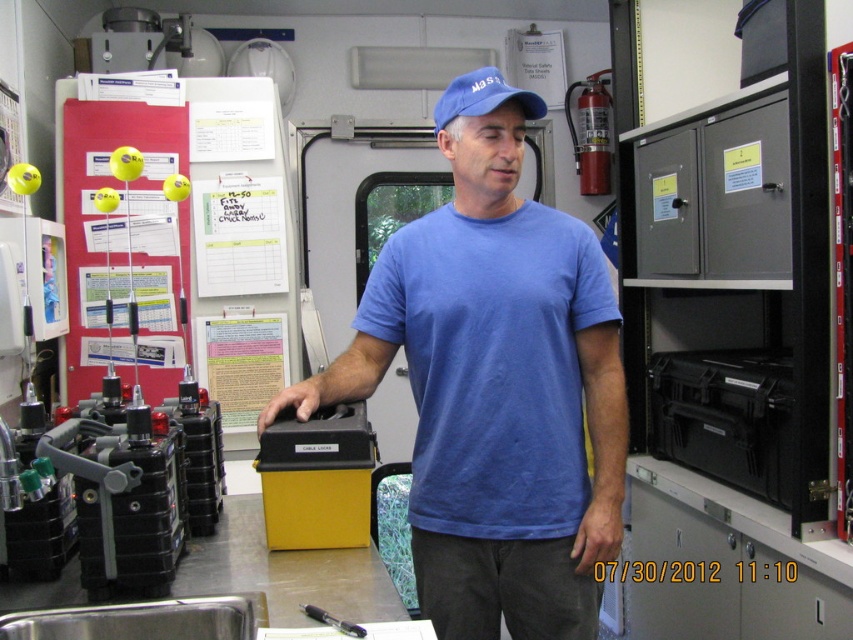
Question: Which point is farther from the camera taking this photo?

Choices:
 (A) (473, 570)
 (B) (447, 92)
 (C) (579, 269)

Answer: (C)

Question: Is matte blue t-shirt at center thinner than blue fabric cap at center?

Choices:
 (A) no
 (B) yes

Answer: (A)

Question: Which of these objects is positioned closest to the blue cotton t-shirt at center?

Choices:
 (A) blue fabric cap at center
 (B) matte blue t-shirt at center

Answer: (B)

Question: Is matte blue t-shirt at center positioned in front of blue fabric cap at center?

Choices:
 (A) yes
 (B) no

Answer: (B)

Question: Can you confirm if blue cotton t-shirt at center is wider than matte blue t-shirt at center?

Choices:
 (A) yes
 (B) no

Answer: (A)

Question: Which of the following is the farthest from the observer?

Choices:
 (A) blue fabric cap at center
 (B) matte blue t-shirt at center

Answer: (B)